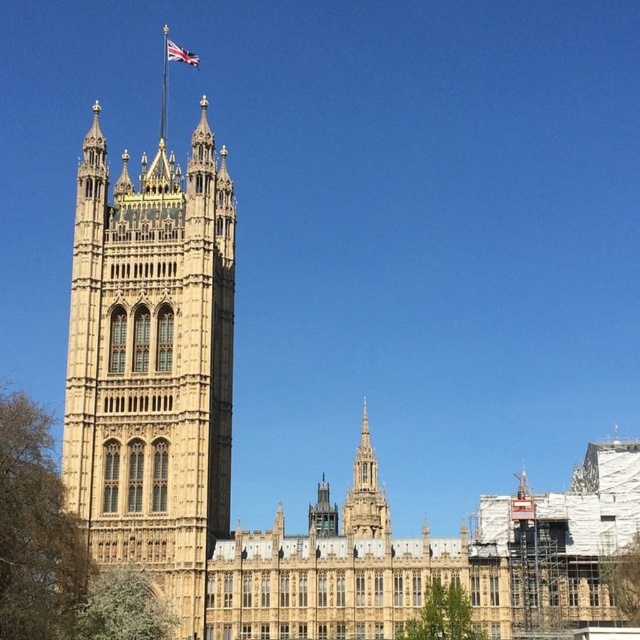
Is golden stone tower at left wider than union jack fabric at top center?

Yes, golden stone tower at left is wider than union jack fabric at top center.

Does golden stone tower at left appear over union jack fabric at top center?

Incorrect, golden stone tower at left is not positioned above union jack fabric at top center.

Who is more forward, (x=134, y=548) or (x=180, y=52)?

Point (x=134, y=548) is in front.

Where is `golden stone tower at left`? The width and height of the screenshot is (640, 640). golden stone tower at left is located at coordinates (152, 364).

Who is lower down, golden stone spire at center or union jack fabric at top center?

Positioned lower is golden stone spire at center.

Does golden stone spire at center have a smaller size compared to union jack fabric at top center?

Incorrect, golden stone spire at center is not smaller in size than union jack fabric at top center.

Between point (355, 522) and point (184, 58), which one is positioned in front?

Point (355, 522)

At what (x,y) coordinates should I click in order to perform the action: click on golden stone spire at center. Please return your answer as a coordinate pair (x, y). This screenshot has height=640, width=640. Looking at the image, I should click on (364, 492).

Which is more to the right, golden stone tower at left or golden stone spire at center?

golden stone spire at center is more to the right.

Does golden stone tower at left have a lesser height compared to golden stone spire at center?

In fact, golden stone tower at left may be taller than golden stone spire at center.

Identify the location of golden stone tower at left. (152, 364).